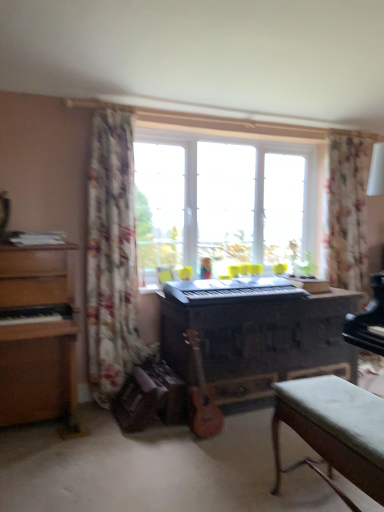
Question: From the image's perspective, is wooden acoustic guitar at center located above or below wooden piano at center?

Choices:
 (A) below
 (B) above

Answer: (A)

Question: From a real-world perspective, is wooden acoustic guitar at center above or below wooden piano at center?

Choices:
 (A) above
 (B) below

Answer: (B)

Question: Estimate the real-world distances between objects in this image. Which object is farther from the floral fabric curtain at upper right, which appears as the first curtain when viewed from the back?

Choices:
 (A) transparent glass window at center
 (B) wooden acoustic guitar at center
 (C) wooden piano at center
 (D) wooden chest of drawers at left
 (E) green fabric bench at lower right

Answer: (D)

Question: Estimate the real-world distances between objects in this image. Which object is farther from the floral fabric curtain at left, which ranks as the first curtain in left-to-right order?

Choices:
 (A) wooden chest of drawers at left
 (B) green fabric bench at lower right
 (C) floral fabric curtain at upper right, which appears as the second curtain when viewed from the left
 (D) transparent glass window at center
 (E) black plastic keyboard at center

Answer: (C)